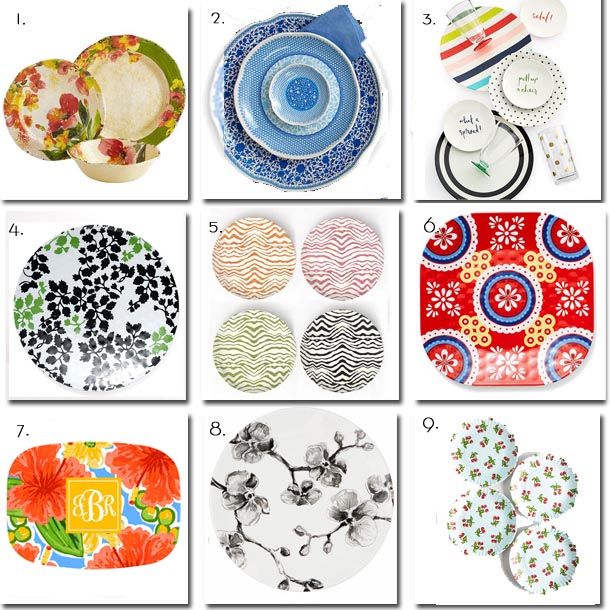
Locate an element on the screen. orange plate with zigzags is located at coordinates (253, 259).